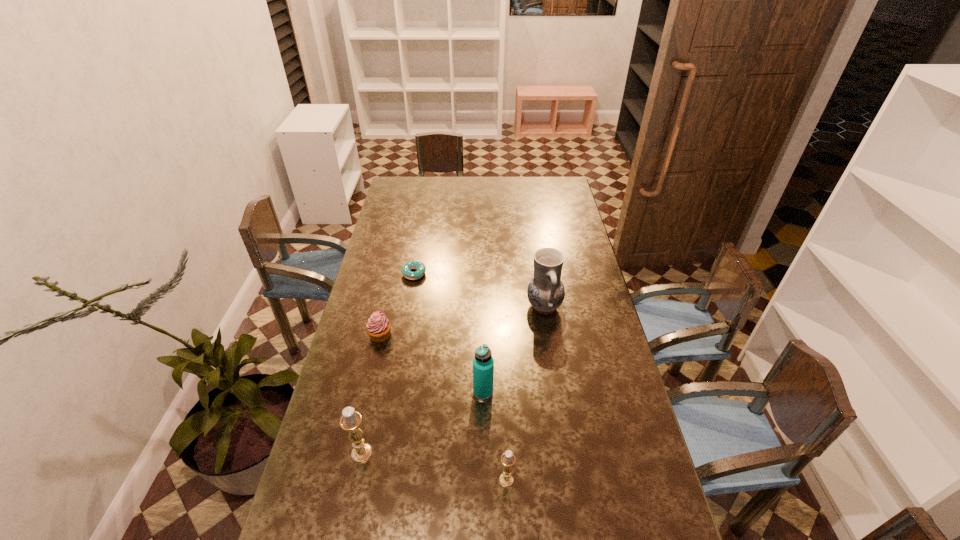
The height and width of the screenshot is (540, 960). In order to click on blank region between the shorter candle holder and the shortest object in this screenshot , I will do `click(460, 377)`.

I want to click on vacant area between the fifth nearest object and the taller candle holder, so click(x=453, y=380).

Where is `unoccupied area between the farther candle holder and the rightmost object`? The height and width of the screenshot is (540, 960). unoccupied area between the farther candle holder and the rightmost object is located at coordinates (453, 380).

At what (x,y) coordinates should I click in order to perform the action: click on empty space between the left candle holder and the shorter candle holder. Please return your answer as a coordinate pair (x, y). Looking at the image, I should click on [x=434, y=467].

The width and height of the screenshot is (960, 540). What are the coordinates of `free spot between the left candle holder and the doughnut` in the screenshot? It's located at (388, 363).

The width and height of the screenshot is (960, 540). What are the coordinates of `vacant region between the water bottle and the farthest object` in the screenshot? It's located at (448, 333).

At what (x,y) coordinates should I click in order to perform the action: click on unoccupied position between the third farthest object and the shorter candle holder. Please return your answer as a coordinate pair (x, y). Looking at the image, I should click on (444, 408).

I want to click on vacant space that's between the shortest object and the taller candle holder, so click(388, 363).

You are a GUI agent. You are given a task and a screenshot of the screen. Output one action in this format:
    pyautogui.click(x=<x>, y=<y>)
    Task: Click on the object identified as the fifth closest to the right candle holder
    
    Given the screenshot: What is the action you would take?
    pyautogui.click(x=419, y=266)

Find the location of `object that is the second closest to the taller candle holder`. object that is the second closest to the taller candle holder is located at coordinates (506, 479).